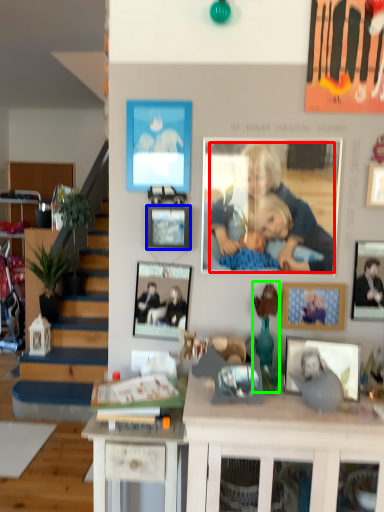
Question: Which is farther away from person (highlighted by a red box)? picture frame (highlighted by a blue box) or toy (highlighted by a green box)?

Choices:
 (A) picture frame
 (B) toy

Answer: (B)